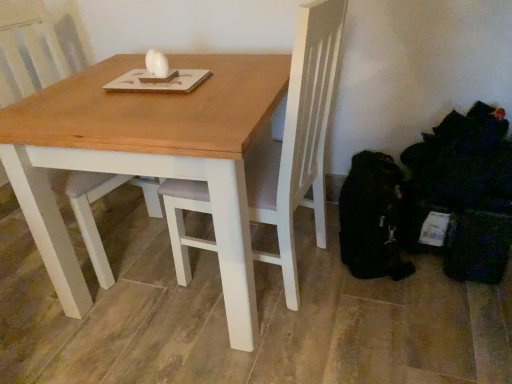
What do you see at coordinates (147, 158) in the screenshot? I see `wooden table at center` at bounding box center [147, 158].

Image resolution: width=512 pixels, height=384 pixels. Identify the location of wooden table at center. (147, 158).

What do you see at coordinates (30, 42) in the screenshot?
I see `white wood chair at center` at bounding box center [30, 42].

What is the approximate width of white wood chair at center?

23.40 inches.

This screenshot has height=384, width=512. In order to click on white wood chair at center in this screenshot , I will do `click(30, 42)`.

The height and width of the screenshot is (384, 512). I want to click on wooden table at center, so click(147, 158).

Which object is positioned more to the right, wooden table at center or white wood chair at center?

wooden table at center is more to the right.

Is the depth of wooden table at center less than that of white wood chair at center?

Yes, wooden table at center is closer to the viewer.

Does point (38, 184) come closer to viewer compared to point (23, 76)?

Yes, it is in front of point (23, 76).

From the image's perspective, is wooden table at center above or below white wood chair at center?

wooden table at center is situated lower than white wood chair at center in the image.

From a real-world perspective, is wooden table at center physically above white wood chair at center?

Actually, wooden table at center is physically below white wood chair at center in the real world.

Does wooden table at center have a greater width compared to white wood chair at center?

Correct, the width of wooden table at center exceeds that of white wood chair at center.

Who is taller, wooden table at center or white wood chair at center?

white wood chair at center.

Between wooden table at center and white wood chair at center, which one has larger size?

wooden table at center.

Is wooden table at center spatially inside white wood chair at center, or outside of it?

wooden table at center exists outside the volume of white wood chair at center.

Is wooden table at center far from white wood chair at center?

Actually, wooden table at center and white wood chair at center are a little close together.

Is wooden table at center positioned with its back to white wood chair at center?

Yes, wooden table at center's orientation is away from white wood chair at center.

Based on the photo, can you tell me how much wooden table at center and white wood chair at center differ in facing direction?

wooden table at center and white wood chair at center are facing 14.6 degrees away from each other.

Measure the distance between wooden table at center and white wood chair at center.

The distance of wooden table at center from white wood chair at center is 28.30 inches.

The height and width of the screenshot is (384, 512). Identify the location of chair lying above the wooden table at center (from the image's perspective). (30, 42).

Would you say white wood chair at center is to the left or to the right of wooden table at center in the picture?

Clearly, white wood chair at center is on the left of wooden table at center in the image.

Is white wood chair at center in front of or behind wooden table at center in the image?

white wood chair at center is behind wooden table at center.

Which is in front, point (73, 208) or point (230, 78)?

The point (230, 78) is closer to the camera.

From the image's perspective, which is below, white wood chair at center or wooden table at center?

wooden table at center.

Based on the photo, from a real-world perspective, is white wood chair at center positioned under wooden table at center based on gravity?

Actually, white wood chair at center is physically above wooden table at center in the real world.

Which of these two, white wood chair at center or wooden table at center, is wider?

wooden table at center.

Is white wood chair at center shorter than wooden table at center?

Incorrect, the height of white wood chair at center does not fall short of that of wooden table at center.

Can you confirm if white wood chair at center is bigger than wooden table at center?

No, white wood chair at center is not bigger than wooden table at center.

Choose the correct answer: Is white wood chair at center inside wooden table at center or outside it?

The correct answer is: outside.

Is white wood chair at center directly adjacent to wooden table at center?

No.

Is white wood chair at center turned away from wooden table at center?

No, white wood chair at center is not facing the opposite direction of wooden table at center.

From the picture: What's the angular difference between white wood chair at center and wooden table at center's facing directions?

The angular difference between white wood chair at center and wooden table at center is 14.6 degrees.

Measure the distance from white wood chair at center to wooden table at center.

A distance of 28.30 inches exists between white wood chair at center and wooden table at center.

Locate an element on the screen. This screenshot has height=384, width=512. table that appears below the white wood chair at center (from the image's perspective) is located at coordinates (147, 158).

The height and width of the screenshot is (384, 512). In order to click on table that appears below the white wood chair at center (from the image's perspective) in this screenshot , I will do `click(147, 158)`.

Find the location of a particular element. The height and width of the screenshot is (384, 512). chair located above the wooden table at center (from the image's perspective) is located at coordinates (30, 42).